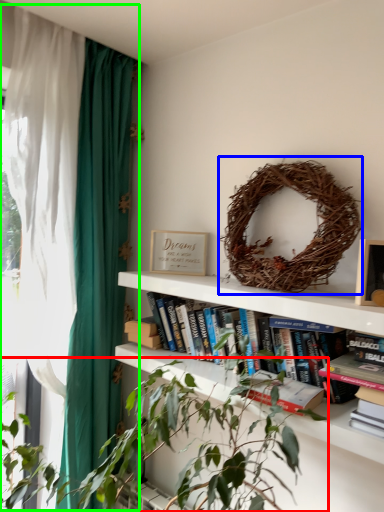
Question: Considering the real-world distances, which object is closest to houseplant (highlighted by a red box)? bird nest (highlighted by a blue box) or curtain (highlighted by a green box).

Choices:
 (A) bird nest
 (B) curtain

Answer: (A)